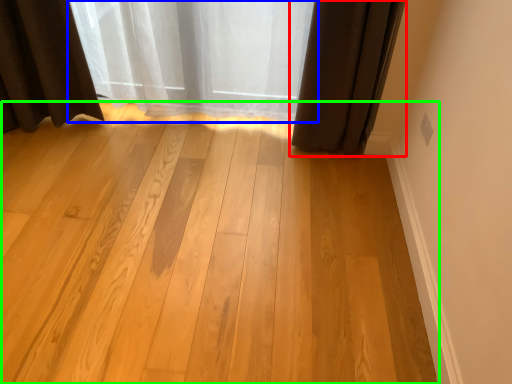
Question: Which object is positioned farthest from curtain (highlighted by a red box)? Select from curtain (highlighted by a blue box) and plank (highlighted by a green box).

Choices:
 (A) curtain
 (B) plank

Answer: (B)